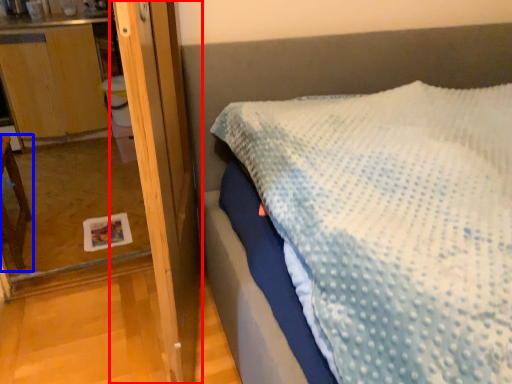
Question: Among these objects, which one is nearest to the camera, screen door (highlighted by a red box) or furniture (highlighted by a blue box)?

Choices:
 (A) screen door
 (B) furniture

Answer: (A)